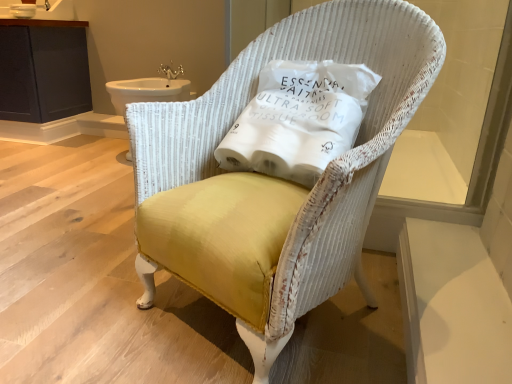
Question: Is white fabric pillow at center not close to white ceramic sink at upper left?

Choices:
 (A) no
 (B) yes

Answer: (B)

Question: Is white ceramic sink at upper left completely or partially inside white fabric pillow at center?

Choices:
 (A) no
 (B) yes

Answer: (A)

Question: Does white fabric pillow at center have a greater height compared to white ceramic sink at upper left?

Choices:
 (A) yes
 (B) no

Answer: (A)

Question: Is white fabric pillow at center facing away from white ceramic sink at upper left?

Choices:
 (A) no
 (B) yes

Answer: (A)

Question: Can you confirm if white fabric pillow at center is thinner than white ceramic sink at upper left?

Choices:
 (A) no
 (B) yes

Answer: (A)

Question: From a real-world perspective, is white fabric pillow at center physically above white ceramic sink at upper left?

Choices:
 (A) yes
 (B) no

Answer: (B)

Question: From a real-world perspective, is yellow fabric chair at center positioned under white ceramic sink at upper left based on gravity?

Choices:
 (A) yes
 (B) no

Answer: (A)

Question: Is yellow fabric chair at center located outside white ceramic sink at upper left?

Choices:
 (A) no
 (B) yes

Answer: (B)

Question: From a real-world perspective, is yellow fabric chair at center physically above white ceramic sink at upper left?

Choices:
 (A) yes
 (B) no

Answer: (B)

Question: From the image's perspective, is yellow fabric chair at center on top of white ceramic sink at upper left?

Choices:
 (A) no
 (B) yes

Answer: (A)

Question: Considering the relative positions of yellow fabric chair at center and white ceramic sink at upper left in the image provided, is yellow fabric chair at center to the left of white ceramic sink at upper left from the viewer's perspective?

Choices:
 (A) no
 (B) yes

Answer: (A)

Question: Is yellow fabric chair at center facing away from white ceramic sink at upper left?

Choices:
 (A) no
 (B) yes

Answer: (A)

Question: Can you confirm if yellow fabric chair at center is wider than white fabric pillow at center?

Choices:
 (A) no
 (B) yes

Answer: (B)